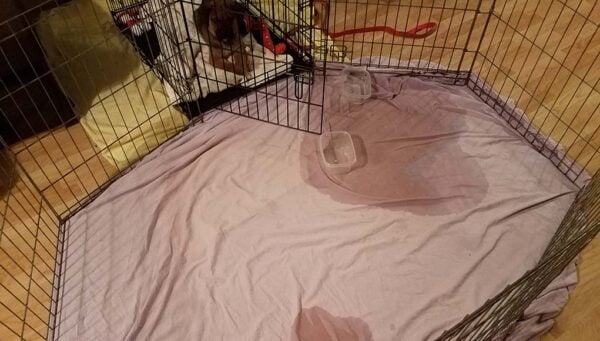
Find the location of `door`. door is located at coordinates (292, 74).